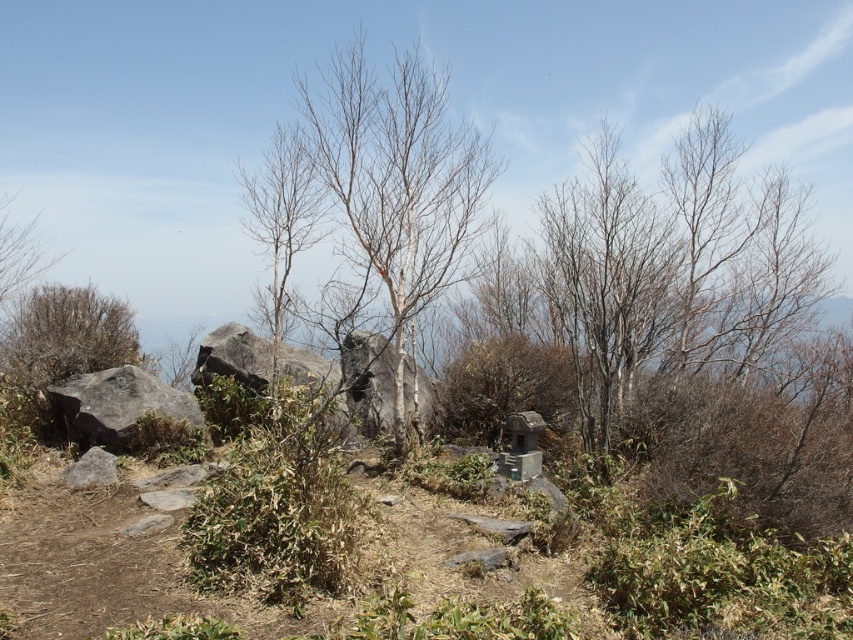
Does brown shrub at left appear under bare branches at left?

Yes.

Which is above, brown shrub at left or bare branches at left?

Positioned higher is bare branches at left.

Describe the element at coordinates (65, 333) in the screenshot. I see `brown shrub at left` at that location.

Locate an element on the screen. This screenshot has height=640, width=853. brown shrub at left is located at coordinates (65, 333).

Between brown shrub at left and gray rough boulder at left, which one has more height?

Standing taller between the two is brown shrub at left.

Which is in front, point (50, 324) or point (169, 406)?

Positioned in front is point (169, 406).

You are a GUI agent. You are given a task and a screenshot of the screen. Output one action in this format:
    pyautogui.click(x=<x>, y=<y>)
    Task: Click on the brown shrub at left
    This screenshot has height=640, width=853.
    Given the screenshot: What is the action you would take?
    pyautogui.click(x=65, y=333)

In the scene shown: Can you confirm if gray rough boulder at left is thinner than bare branches at left?

Indeed, gray rough boulder at left has a lesser width compared to bare branches at left.

Measure the distance between point [68,394] and camera.

They are 7.18 meters apart.

Is point (115, 412) positioned after point (0, 304)?

No, it is not.

Image resolution: width=853 pixels, height=640 pixels. Find the location of `gray rough boulder at left`. gray rough boulder at left is located at coordinates (119, 404).